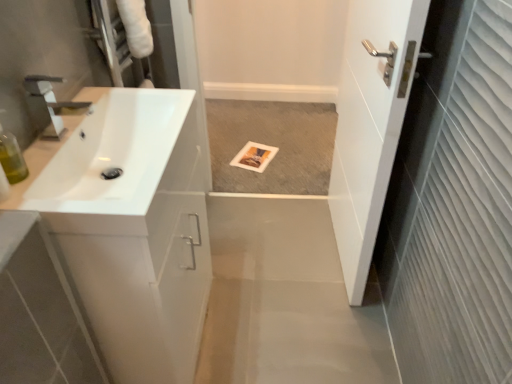
Locate an element on the screen. This screenshot has width=512, height=384. free space to the left of white glossy door at right is located at coordinates (266, 258).